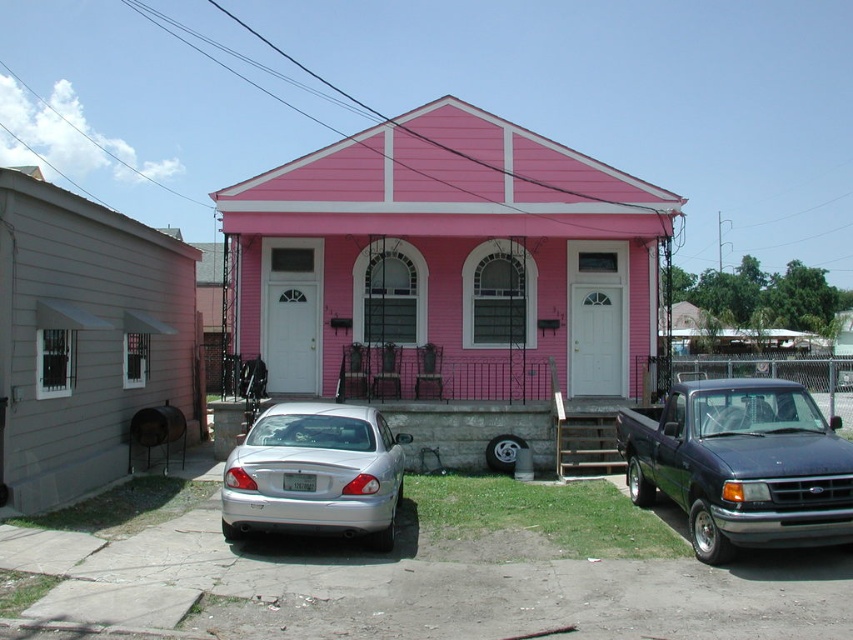
Question: Which point is farther from the camera taking this photo?

Choices:
 (A) [x=227, y=477]
 (B) [x=763, y=518]

Answer: (A)

Question: Is metallic blue truck at right thinner than silver metallic sedan at lower center?

Choices:
 (A) yes
 (B) no

Answer: (A)

Question: Which point is closer to the camera taking this photo?

Choices:
 (A) (273, 518)
 (B) (691, 396)

Answer: (A)

Question: Does metallic blue truck at right have a greater width compared to silver metallic sedan at lower center?

Choices:
 (A) no
 (B) yes

Answer: (A)

Question: Can you confirm if metallic blue truck at right is wider than silver metallic sedan at lower center?

Choices:
 (A) no
 (B) yes

Answer: (A)